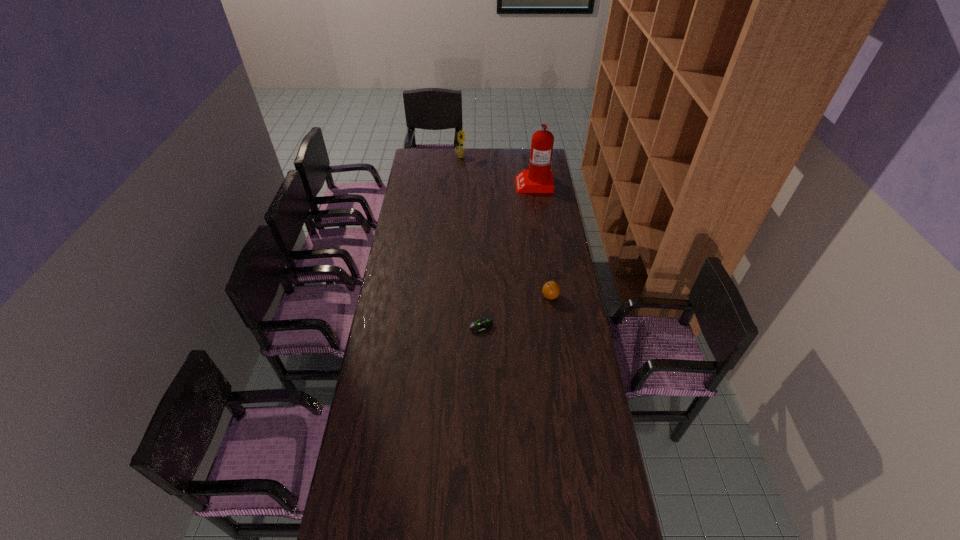
Find the location of a particular element. The width and height of the screenshot is (960, 540). free location located on the front-facing side of the fire extinguisher is located at coordinates (474, 184).

Locate an element on the screen. free space located 0.310m on the face of the farthest object is located at coordinates (516, 157).

The height and width of the screenshot is (540, 960). Find the location of `free space located on the back of the orange`. free space located on the back of the orange is located at coordinates 543,247.

At what (x,y) coordinates should I click in order to perform the action: click on vacant position located 0.340m on the front of the computer mouse. Please return your answer as a coordinate pair (x, y). Looking at the image, I should click on (482, 412).

Find the location of a particular element. The height and width of the screenshot is (540, 960). object at the far edge is located at coordinates (460, 150).

At what (x,y) coordinates should I click in order to perform the action: click on fire extinguisher positioned at the right edge. Please return your answer as a coordinate pair (x, y). This screenshot has height=540, width=960. Looking at the image, I should click on (538, 178).

Where is `orange situated at the right edge`? orange situated at the right edge is located at coordinates (551, 289).

Find the location of a particular element. This screenshot has height=540, width=960. blank space at the far edge is located at coordinates (477, 156).

Image resolution: width=960 pixels, height=540 pixels. In order to click on vacant space at the left edge of the desktop in this screenshot , I will do `click(412, 343)`.

In the image, there is a desktop. Where is `vacant space at the right edge`? vacant space at the right edge is located at coordinates (564, 235).